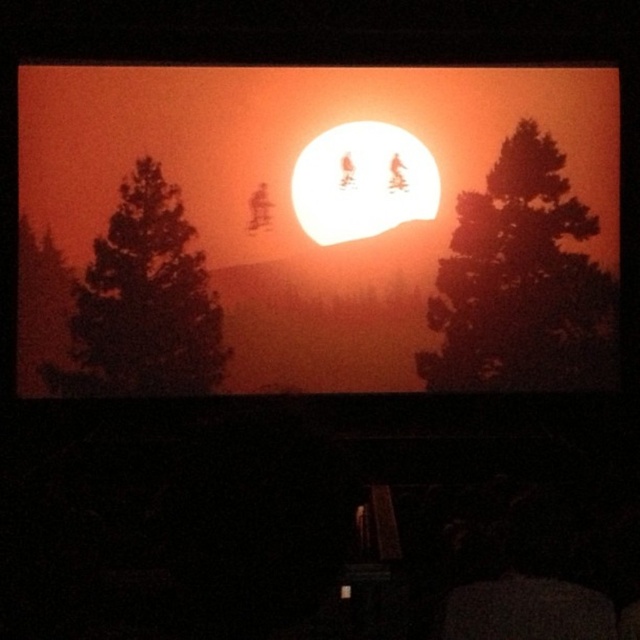
Question: Which object appears closest to the camera in this image?

Choices:
 (A) silhouette tree at right
 (B) matte orange sun at center

Answer: (B)

Question: Is matte orange sun at center above silhouette pine tree at left?

Choices:
 (A) yes
 (B) no

Answer: (A)

Question: Is matte orange sun at center below white matte sun at center?

Choices:
 (A) yes
 (B) no

Answer: (A)

Question: Does matte orange sun at center have a larger size compared to white matte sun at center?

Choices:
 (A) yes
 (B) no

Answer: (A)

Question: Which of these objects is positioned closest to the silhouette pine tree at left?

Choices:
 (A) silhouette tree at right
 (B) matte orange sun at center
 (C) white matte sun at center

Answer: (B)

Question: Among these objects, which one is farthest from the camera?

Choices:
 (A) silhouette pine tree at left
 (B) white matte sun at center
 (C) matte orange sun at center
 (D) silhouette tree at right

Answer: (D)